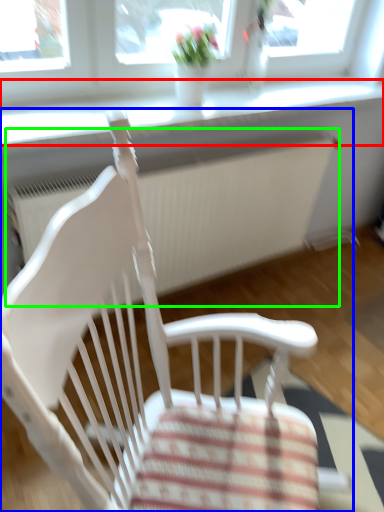
Question: Which object is positioned farthest from window sill (highlighted by a red box)? Select from chair (highlighted by a blue box) and radiator (highlighted by a green box).

Choices:
 (A) chair
 (B) radiator

Answer: (A)